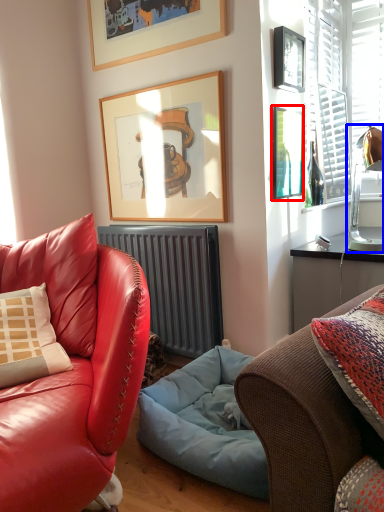
Question: Which point is closer to the camera, picture frame (highlighted by a red box) or lamp (highlighted by a blue box)?

Choices:
 (A) picture frame
 (B) lamp

Answer: (B)